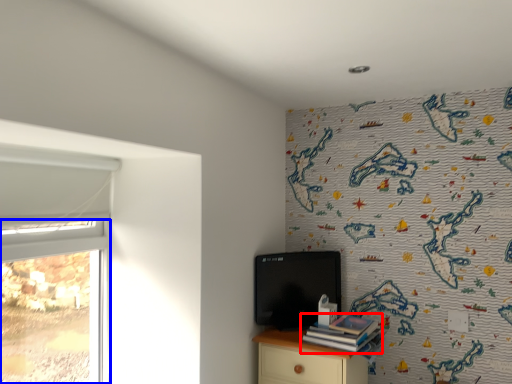
Question: Among these objects, which one is farthest to the camera, book (highlighted by a red box) or window (highlighted by a blue box)?

Choices:
 (A) book
 (B) window

Answer: (A)